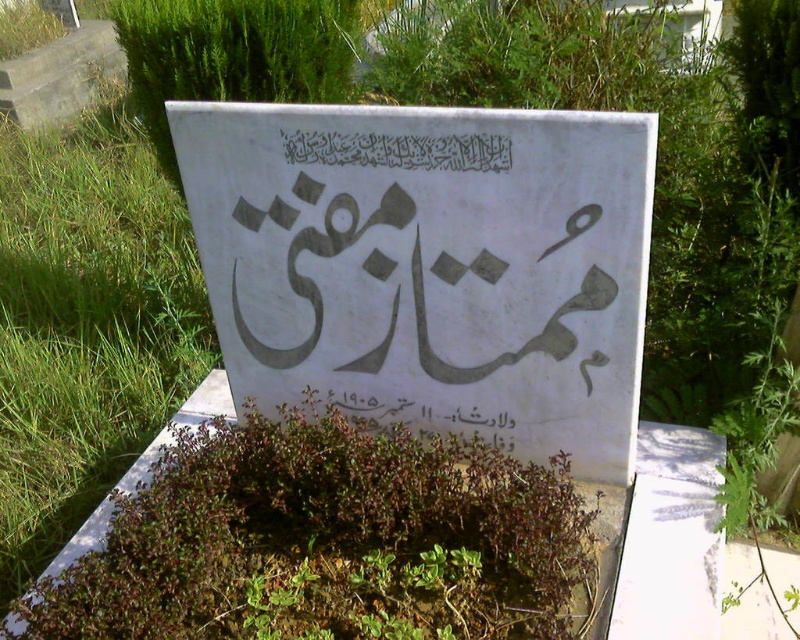
You are a gardener tasked with maintaining the plants around the tombstone. You notice the green leafy plant at center and the black calligraphy at center. Which object is wider?

The green leafy plant at center is wider than the black calligraphy at center.

You are a visitor at the cemetery and want to place a bouquet of flowers on the tombstone. The bouquet is taller than the green leafy plant at center. Can you determine if the bouquet will be visible above the white paper sign at center?

The white paper sign at center is taller than the green leafy plant at center. Since the bouquet is taller than the green leafy plant at center, it might still be visible above the white paper sign at center depending on the exact height difference between the bouquet and the sign. However, without knowing the exact height of the bouquet compared to the sign, it is uncertain.

You are visiting a cemetery and notice two items on a tombstone. One is a white paper sign at center and the other is a black calligraphy at center. Which item is positioned lower on the tombstone?

The white paper sign at center is below the black calligraphy at center, so the white paper sign at center is positioned lower on the tombstone.